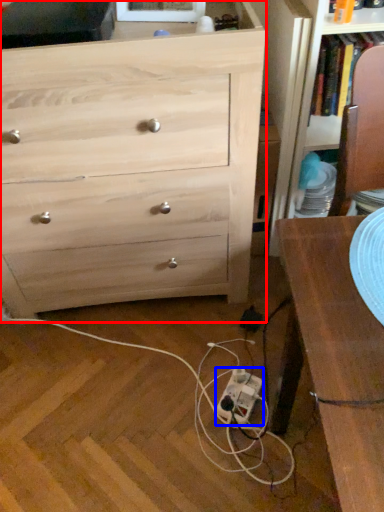
Question: Which point is closer to the camera, chest of drawers (highlighted by a red box) or extension cord (highlighted by a blue box)?

Choices:
 (A) chest of drawers
 (B) extension cord

Answer: (A)